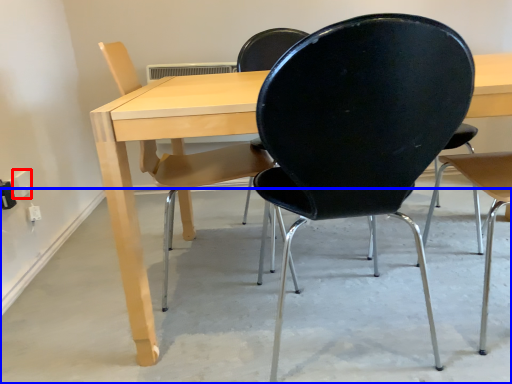
Question: Which of the following is the farthest to the observer, electric outlet (highlighted by a red box) or concrete (highlighted by a blue box)?

Choices:
 (A) electric outlet
 (B) concrete

Answer: (A)